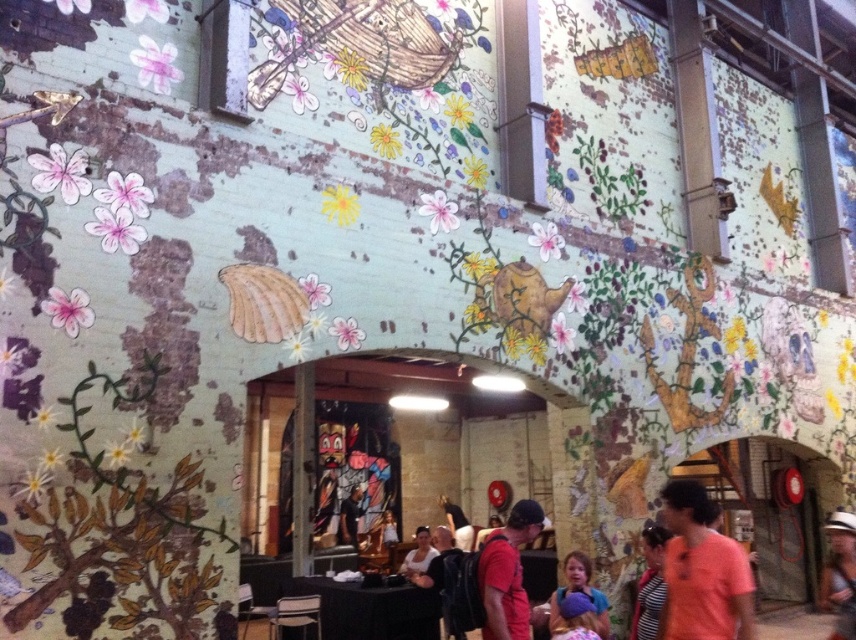
Who is lower down, matte pink shirt at center or dark brown leather jacket at center?

dark brown leather jacket at center

Does matte pink shirt at center have a greater width compared to dark brown leather jacket at center?

Yes.

Is point (676, 500) positioned behind point (355, 497)?

No.

Image resolution: width=856 pixels, height=640 pixels. I want to click on matte pink shirt at center, so pyautogui.click(x=702, y=572).

Which is in front, point (837, 538) or point (569, 568)?

Positioned in front is point (569, 568).

Is point (843, 598) positioned after point (556, 614)?

Yes, it is behind point (556, 614).

Where is `white matte hat at lower right`? This screenshot has width=856, height=640. white matte hat at lower right is located at coordinates (840, 573).

Can you confirm if matte purple shirt at center is wider than dark brown leather jacket at center?

Yes.

Measure the distance between matte purple shirt at center and camera.

They are 17.19 feet apart.

Who is more distant from viewer, (605, 600) or (345, 540)?

The point (345, 540) is behind.

Find the location of `matte purple shirt at center`. matte purple shirt at center is located at coordinates (580, 592).